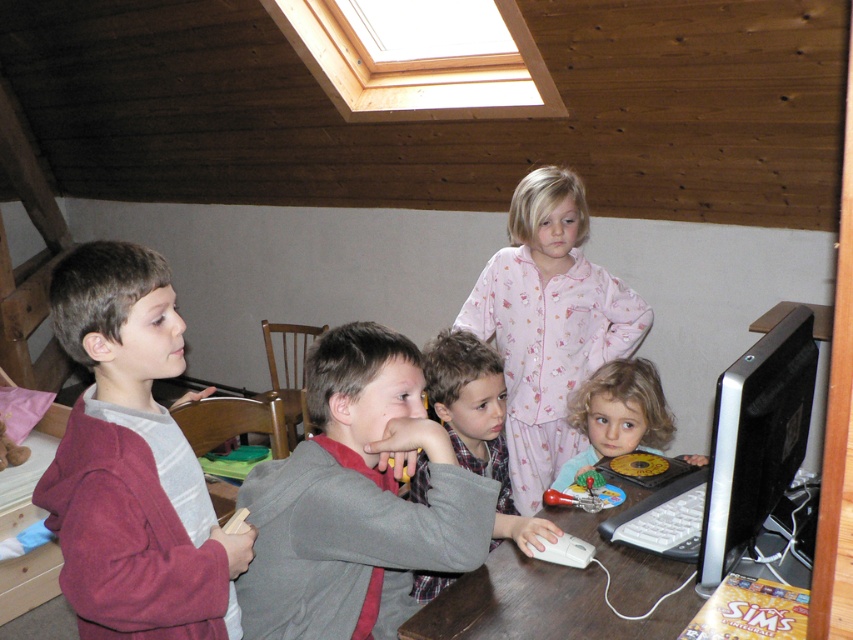
Question: Which of the following is the farthest from the observer?

Choices:
 (A) blonde curly hair at lower center
 (B) maroon fleece jacket at left

Answer: (A)

Question: Which object is positioned closest to the gray fabric shirt at center?

Choices:
 (A) black glossy monitor at right
 (B) brown wooden table at lower center
 (C) blonde curly hair at lower center
 (D) maroon fleece jacket at left

Answer: (D)

Question: Among these points, which one is farthest from the camera?

Choices:
 (A) (486, 394)
 (B) (376, 472)
 (C) (552, 216)
 (D) (596, 490)

Answer: (C)

Question: Does maroon fleece jacket at left come behind pink cotton pajamas at center?

Choices:
 (A) yes
 (B) no

Answer: (B)

Question: Does brown wooden table at lower center have a lesser width compared to matte plastic toy at center?

Choices:
 (A) no
 (B) yes

Answer: (A)

Question: Does pink cotton pajamas at center appear under black glossy monitor at right?

Choices:
 (A) no
 (B) yes

Answer: (A)